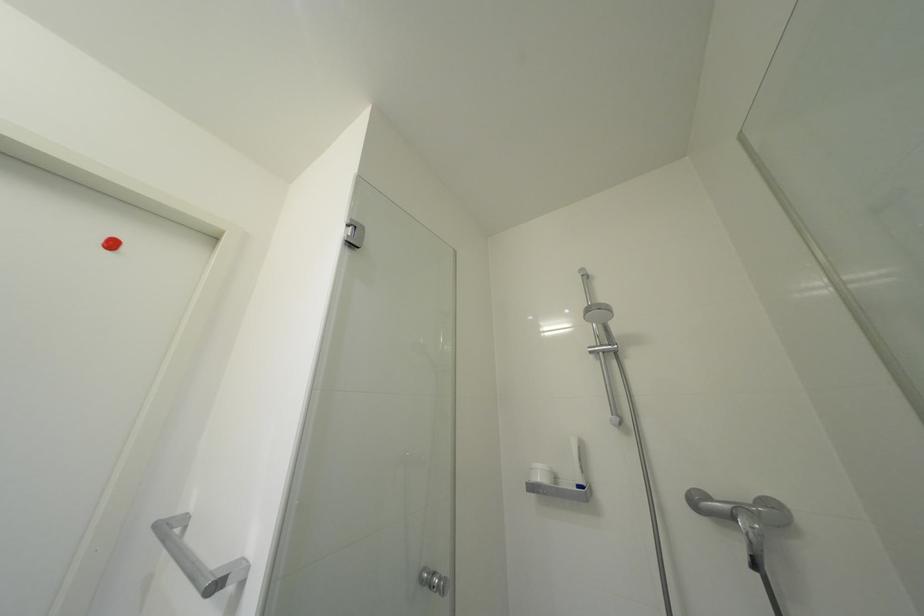
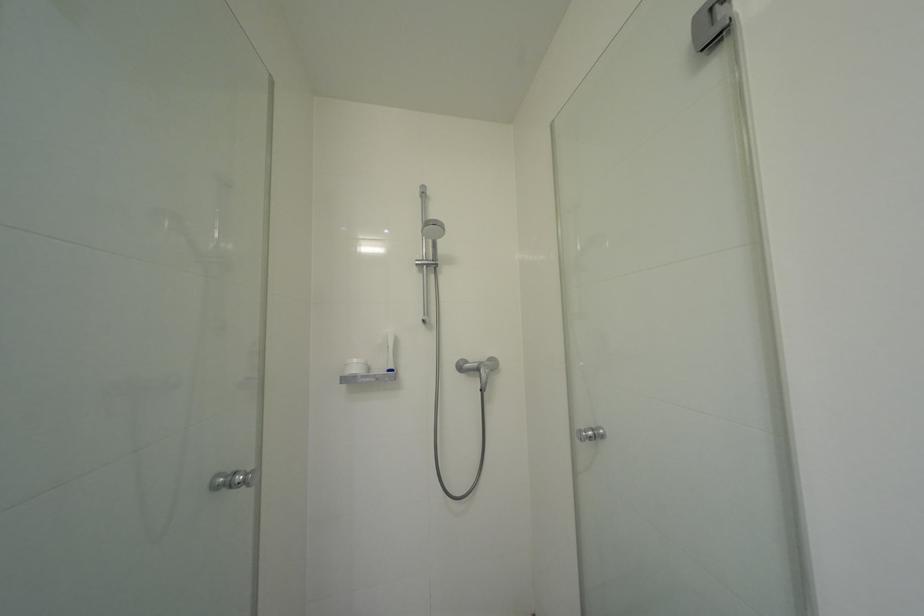
Question: How did the camera likely rotate?

Choices:
 (A) Left
 (B) Right
 (C) Up
 (D) Down

Answer: (B)